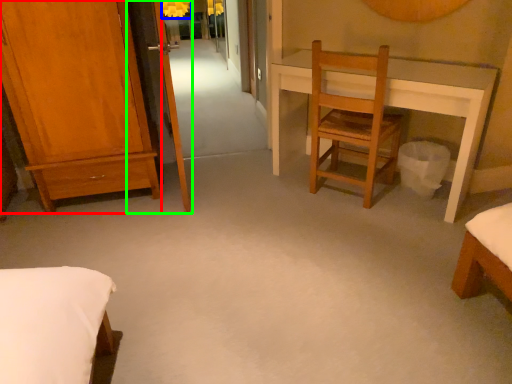
Question: Which object is positioned farthest from furniture (highlighted by a red box)? Select from lamp (highlighted by a blue box) and screen door (highlighted by a green box).

Choices:
 (A) lamp
 (B) screen door

Answer: (A)